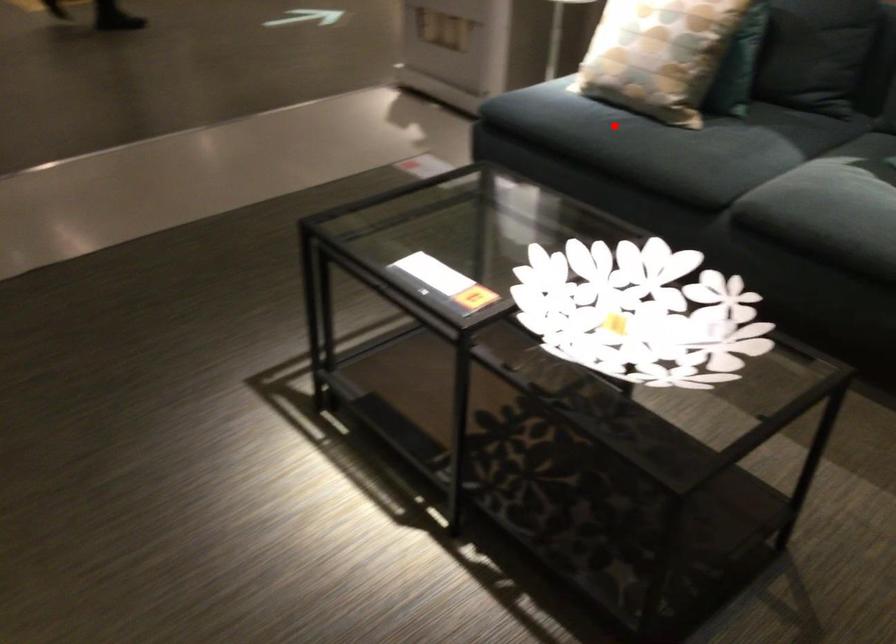
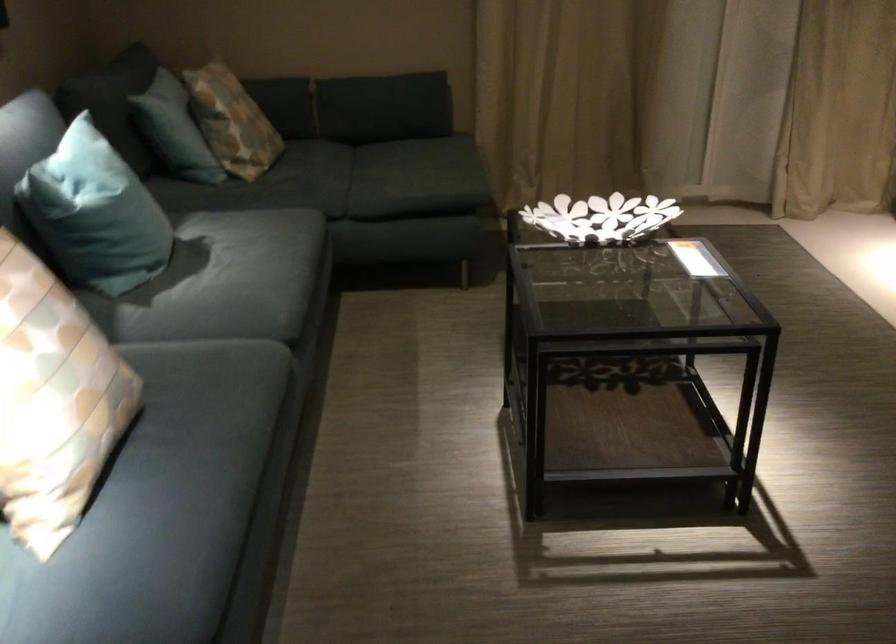
Find the pixel in the second image that matches the highlighted location in the first image.

(197, 436)